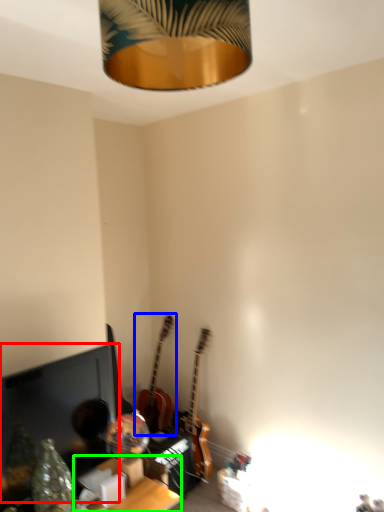
Question: Estimate the real-world distances between objects in this image. Which object is farther from computer monitor (highlighted by a red box), guitar (highlighted by a blue box) or table (highlighted by a green box)?

Choices:
 (A) guitar
 (B) table

Answer: (A)